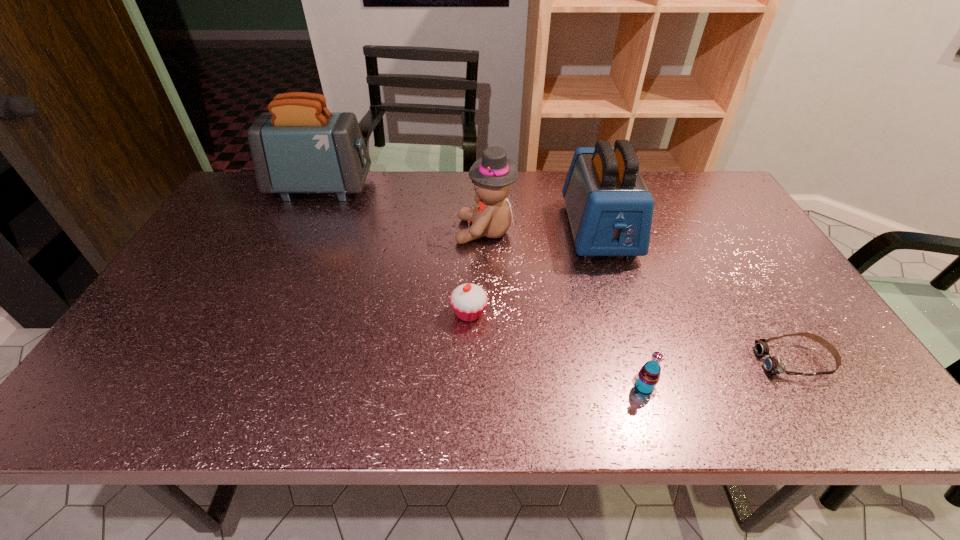
You are a GUI agent. You are given a task and a screenshot of the screen. Output one action in this format:
    pyautogui.click(x=<x>, y=<y>)
    Task: Click on the vacant point located 0.140m on the front-facing side of the rag_doll
    The height and width of the screenshot is (540, 960).
    Given the screenshot: What is the action you would take?
    pyautogui.click(x=409, y=231)

The width and height of the screenshot is (960, 540). Identify the location of free region located on the front-facing side of the rag_doll. (336, 231).

You are a GUI agent. You are given a task and a screenshot of the screen. Output one action in this format:
    pyautogui.click(x=<x>, y=<y>)
    Task: Click on the free space located on the front-facing side of the rag_doll
    
    Given the screenshot: What is the action you would take?
    pyautogui.click(x=346, y=231)

Locate an element on the screen. vacant region located 0.270m on the right of the soda is located at coordinates (783, 387).

The width and height of the screenshot is (960, 540). Find the location of `blank space located 0.100m on the front of the fifth tallest object`. blank space located 0.100m on the front of the fifth tallest object is located at coordinates (468, 362).

Find the location of a particular element. Image resolution: width=960 pixels, height=540 pixels. vacant region located 0.360m on the front-facing side of the rightmost object is located at coordinates (598, 361).

Identify the location of vacant space situated 0.340m on the front-facing side of the rightmost object. The image size is (960, 540). (608, 361).

Find the location of `blank area located on the front-facing side of the rightmost object`. blank area located on the front-facing side of the rightmost object is located at coordinates (603, 361).

At what (x,y) coordinates should I click in order to perform the action: click on rag_doll located at the far edge. Please return your answer as a coordinate pair (x, y). Looking at the image, I should click on (492, 175).

Identify the location of soda positioned at the near edge. (645, 381).